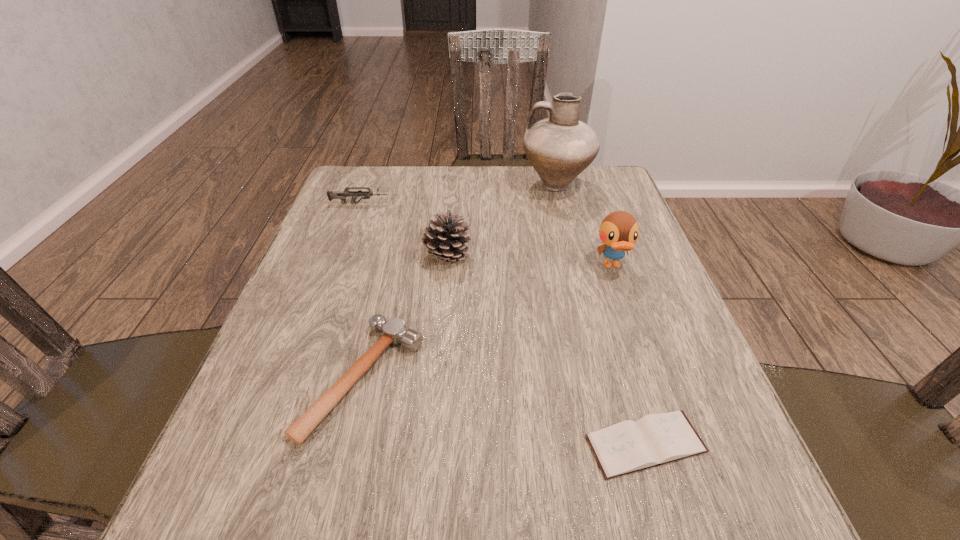
This screenshot has height=540, width=960. I want to click on vacant area at the near left corner of the desktop, so click(299, 508).

This screenshot has width=960, height=540. Find the location of `free space between the pinecone and the tallest object`. free space between the pinecone and the tallest object is located at coordinates (502, 220).

The width and height of the screenshot is (960, 540). What are the coordinates of `free space that is in between the pitcher and the duck` in the screenshot? It's located at (584, 225).

Find the location of a particular element. Image resolution: width=960 pixels, height=540 pixels. blank region between the pinecone and the pitcher is located at coordinates (502, 220).

Find the location of a particular element. The width and height of the screenshot is (960, 540). empty space between the pinecone and the gun is located at coordinates (403, 230).

Locate an element on the screen. This screenshot has width=960, height=540. free area in between the pinecone and the shortest object is located at coordinates (546, 350).

Locate an element on the screen. free space between the fifth tallest object and the duck is located at coordinates (488, 322).

The width and height of the screenshot is (960, 540). I want to click on vacant area that lies between the shortest object and the gun, so click(502, 324).

I want to click on free space that is in between the shortest object and the fourth tallest object, so click(502, 324).

This screenshot has width=960, height=540. I want to click on empty space that is in between the gun and the tallest object, so click(458, 194).